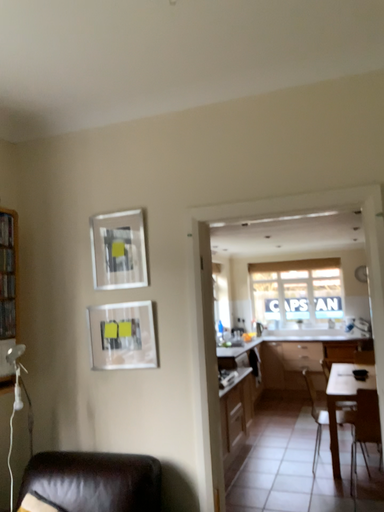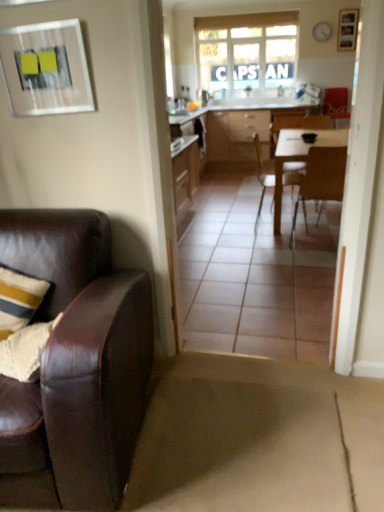
Question: Which way did the camera rotate in the video?

Choices:
 (A) rotated upward
 (B) rotated downward

Answer: (B)